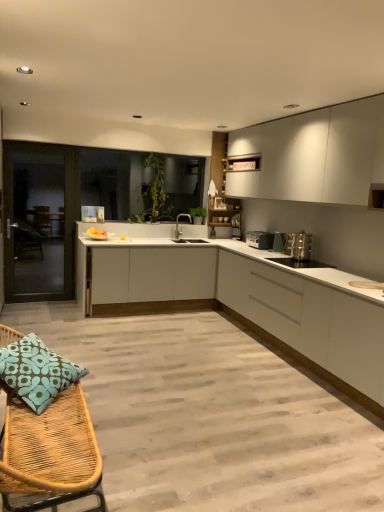
Identify the location of free point behind woven wood bench at lower left. The width and height of the screenshot is (384, 512). pyautogui.click(x=142, y=406).